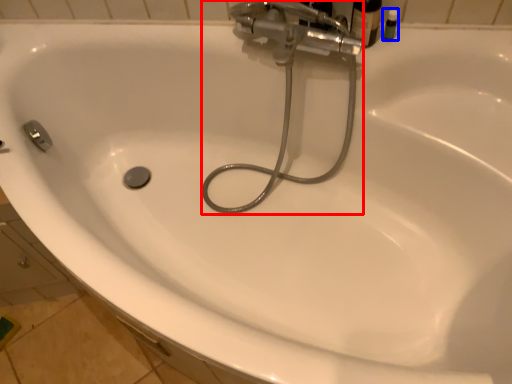
Question: Which of the following is the closest to the observer, plumbing fixture (highlighted by a red box) or toiletry (highlighted by a blue box)?

Choices:
 (A) plumbing fixture
 (B) toiletry

Answer: (A)